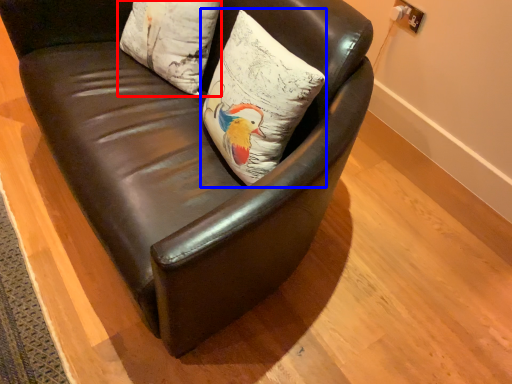
Question: Among these objects, which one is farthest to the camera, pillow (highlighted by a red box) or pillow (highlighted by a blue box)?

Choices:
 (A) pillow
 (B) pillow

Answer: (A)